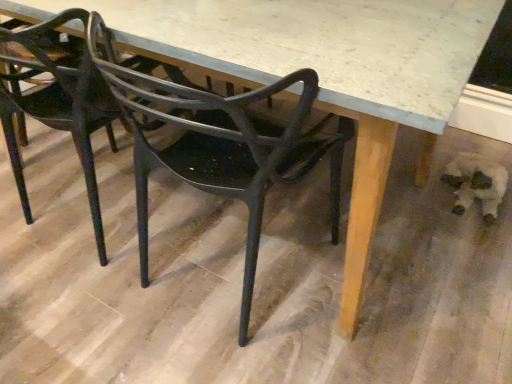
Question: Is matte black chair at center, the 1th chair in the left-to-right sequence, a part of fuzzy white dog at lower right?

Choices:
 (A) no
 (B) yes

Answer: (A)

Question: Can you confirm if fuzzy white dog at lower right is positioned to the right of matte black chair at center, placed as the second chair when sorted from right to left?

Choices:
 (A) no
 (B) yes

Answer: (B)

Question: Is fuzzy white dog at lower right wider than matte black chair at center, placed as the second chair when sorted from right to left?

Choices:
 (A) no
 (B) yes

Answer: (A)

Question: Is matte black chair at center, the 1th chair in the left-to-right sequence, at the back of fuzzy white dog at lower right?

Choices:
 (A) no
 (B) yes

Answer: (A)

Question: Is fuzzy white dog at lower right to the left of matte black chair at center, placed as the second chair when sorted from right to left, from the viewer's perspective?

Choices:
 (A) yes
 (B) no

Answer: (B)

Question: Based on their sizes in the image, would you say matte black chair at center, placed as the second chair when sorted from right to left, is bigger or smaller than fuzzy white dog at lower right?

Choices:
 (A) small
 (B) big

Answer: (B)

Question: In the image, is matte black chair at center, placed as the second chair when sorted from right to left, positioned in front of or behind fuzzy white dog at lower right?

Choices:
 (A) front
 (B) behind

Answer: (A)

Question: Would you say matte black chair at center, placed as the second chair when sorted from right to left, is to the left or to the right of fuzzy white dog at lower right in the picture?

Choices:
 (A) left
 (B) right

Answer: (A)

Question: In terms of width, does matte black chair at center, the 1th chair in the left-to-right sequence, look wider or thinner when compared to fuzzy white dog at lower right?

Choices:
 (A) wide
 (B) thin

Answer: (A)

Question: Is point (485, 190) closer or farther from the camera than point (78, 81)?

Choices:
 (A) farther
 (B) closer

Answer: (A)

Question: Would you say fuzzy white dog at lower right is to the left or to the right of matte black chair at center, the 1th chair in the left-to-right sequence, in the picture?

Choices:
 (A) left
 (B) right

Answer: (B)

Question: Relative to matte black chair at center, placed as the second chair when sorted from right to left, is fuzzy white dog at lower right in front or behind?

Choices:
 (A) front
 (B) behind

Answer: (B)

Question: Which is correct: fuzzy white dog at lower right is inside matte black chair at center, the 1th chair in the left-to-right sequence, or outside of it?

Choices:
 (A) outside
 (B) inside

Answer: (A)

Question: From a real-world perspective, is matte black chair at center, placed as the second chair when sorted from right to left, above or below matte black chair at center, the second chair positioned from the left?

Choices:
 (A) below
 (B) above

Answer: (B)

Question: Is matte black chair at center, the 1th chair in the left-to-right sequence, in front of or behind matte black chair at center, the second chair positioned from the left, in the image?

Choices:
 (A) behind
 (B) front

Answer: (A)